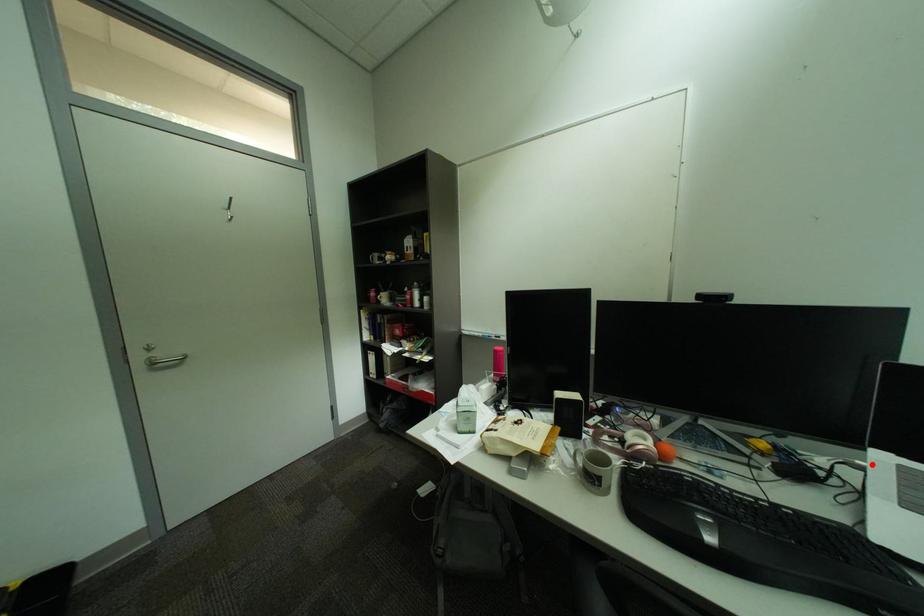
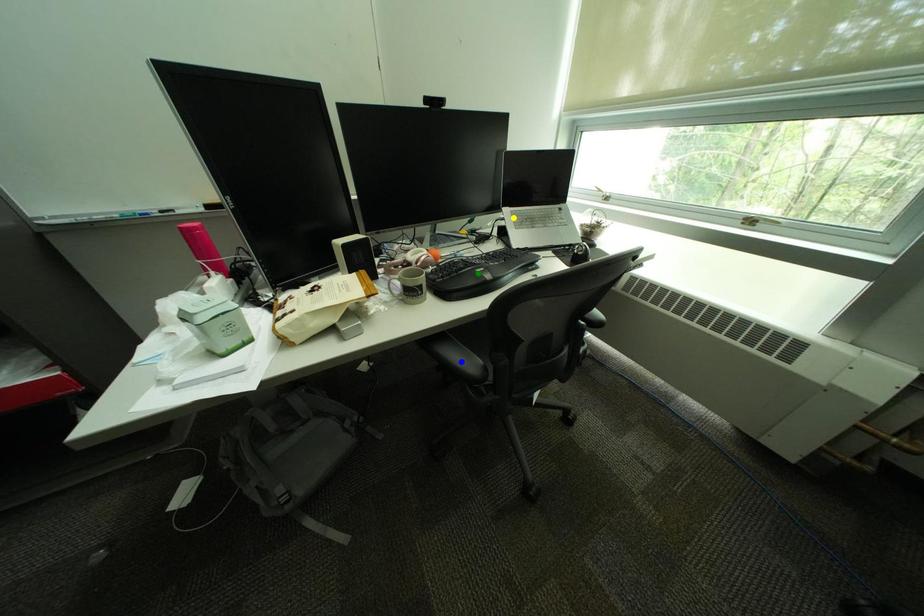
Question: I am providing you with two images of the same scene from different viewpoints. A red point is marked on the first image. You are given multiple points on the second image. Which point in image 2 represents the same 3d spot as the red point in image 1?

Choices:
 (A) yellow point
 (B) blue point
 (C) green point

Answer: (A)